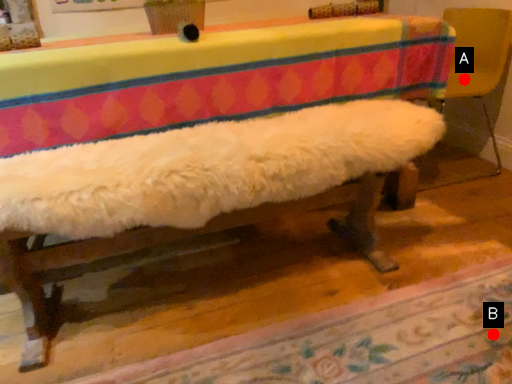
Question: Two points are circled on the image, labeled by A and B beside each circle. Among these points, which one is farthest from the camera?

Choices:
 (A) A is further
 (B) B is further

Answer: (A)